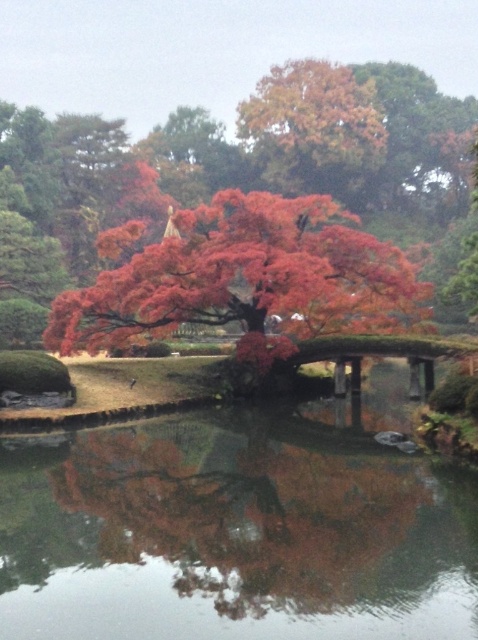
Question: Which object is positioned farthest from the shiny red maple tree at center?

Choices:
 (A) orange-brown textured tree at upper center
 (B) transparent water at center
 (C) green moss-covered bridge at center

Answer: (A)

Question: Which of the following is the farthest from the observer?

Choices:
 (A) transparent water at center
 (B) green moss-covered bridge at center

Answer: (B)

Question: Can you confirm if transparent water at center is positioned to the right of green moss-covered bridge at center?

Choices:
 (A) yes
 (B) no

Answer: (B)

Question: Which point is closer to the camera?

Choices:
 (A) transparent water at center
 (B) green moss-covered bridge at center
 (C) orange-brown textured tree at upper center
 (D) shiny red maple tree at center

Answer: (A)

Question: Is transparent water at center to the left of shiny red maple tree at center from the viewer's perspective?

Choices:
 (A) no
 (B) yes

Answer: (A)

Question: Is transparent water at center below shiny red maple tree at center?

Choices:
 (A) yes
 (B) no

Answer: (A)